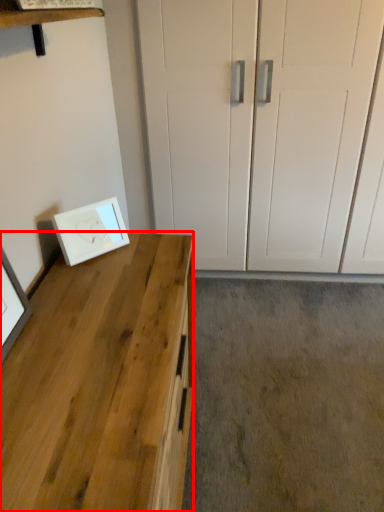
Question: Considering the relative positions of desk (annotated by the red box) and picture frame in the image provided, where is desk (annotated by the red box) located with respect to the staircase?

Choices:
 (A) left
 (B) right

Answer: (B)